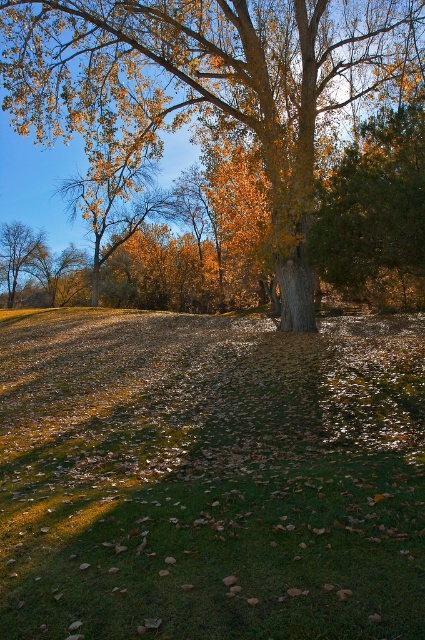
You are standing in the park and see the green grass at center and the smooth brown tree trunk at left. Which object is closer to you?

The green grass at center is closer to you because it is positioned under the smooth brown tree trunk at left, meaning the grass is in front of the trunk.

You are standing in the park and see the green grass at center and the golden textured tree at center. Which object is closer to the ground?

The green grass at center is closer to the ground as it is positioned below the golden textured tree at center.